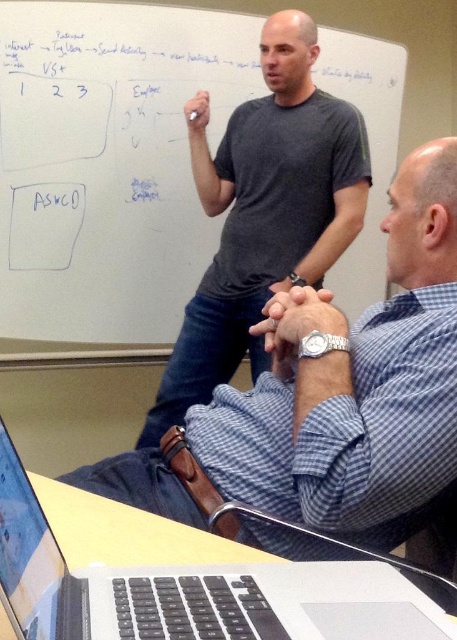
Question: Which point is closer to the camera?

Choices:
 (A) (201, 221)
 (B) (377, 531)
 (C) (354, 579)

Answer: (C)

Question: Does white matte board at upper center come behind blue checkered shirt at center?

Choices:
 (A) no
 (B) yes

Answer: (B)

Question: Based on their relative distances, which object is farther from the silver/black plastic laptop at lower center?

Choices:
 (A) blue checkered shirt at center
 (B) white matte board at upper center

Answer: (B)

Question: Estimate the real-world distances between objects in this image. Which object is closer to the silver/black plastic laptop at lower center?

Choices:
 (A) white matte board at upper center
 (B) blue checkered shirt at center

Answer: (B)

Question: Can you confirm if white matte board at upper center is positioned to the right of blue checkered shirt at center?

Choices:
 (A) no
 (B) yes

Answer: (A)

Question: Can you confirm if white matte board at upper center is positioned to the right of blue checkered shirt at center?

Choices:
 (A) yes
 (B) no

Answer: (B)